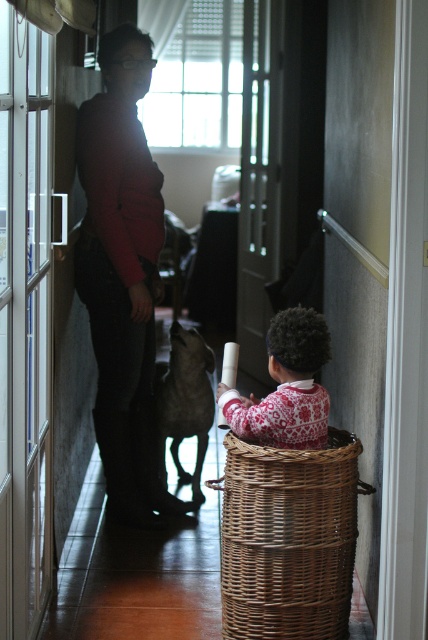
Image resolution: width=428 pixels, height=640 pixels. What do you see at coordinates (122, 276) in the screenshot?
I see `matte red sweater at center` at bounding box center [122, 276].

Which is below, matte red sweater at center or red and white sweater at center?

red and white sweater at center is below.

Which is in front, point (151, 362) or point (219, 381)?

Point (219, 381) is more forward.

The image size is (428, 640). I want to click on matte red sweater at center, so click(x=122, y=276).

Does woven brown basket at lower right appear under red and white sweater at center?

Yes, woven brown basket at lower right is below red and white sweater at center.

Is woven brown basket at lower right closer to the viewer compared to red and white sweater at center?

Yes, it is in front of red and white sweater at center.

Between point (264, 582) and point (306, 314), which one is positioned behind?

Positioned behind is point (306, 314).

Identify the location of woven brown basket at lower right. (288, 538).

Is matte red sweater at center smaller than woven brown basket at lower right?

No.

Which is below, matte red sweater at center or woven brown basket at lower right?

woven brown basket at lower right is lower down.

Locate an element on the screen. This screenshot has height=640, width=428. matte red sweater at center is located at coordinates (122, 276).

This screenshot has width=428, height=640. Identify the location of matte red sweater at center. [122, 276].